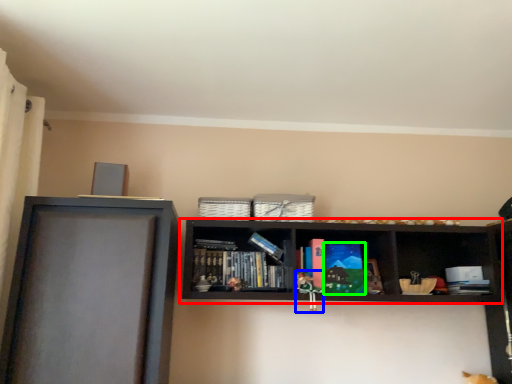
Question: Which object is positioned closest to shelf (highlighted by a red box)? Select from toy (highlighted by a blue box) and paperback book (highlighted by a green box).

Choices:
 (A) toy
 (B) paperback book

Answer: (B)